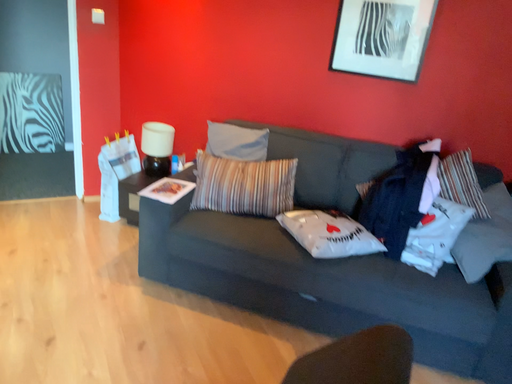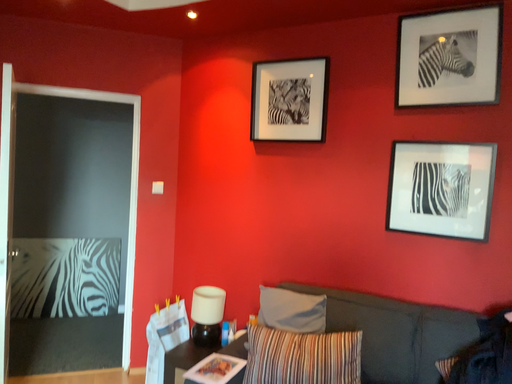
Question: Which way did the camera rotate in the video?

Choices:
 (A) rotated left
 (B) rotated right

Answer: (A)